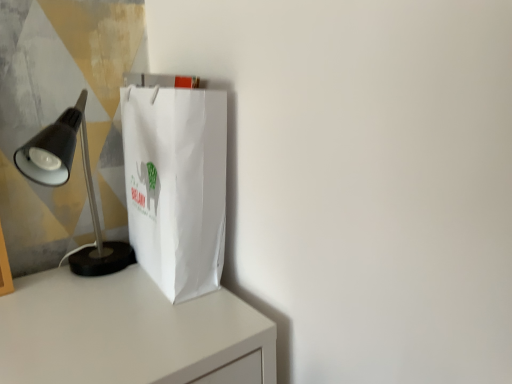
Question: From the image's perspective, is matte black lamp at left located above or below white paper bag at center?

Choices:
 (A) below
 (B) above

Answer: (A)

Question: From a real-world perspective, relative to white paper bag at center, is matte black lamp at left vertically above or below?

Choices:
 (A) below
 (B) above

Answer: (A)

Question: Considering the positions of matte black lamp at left and white paper bag at center in the image, is matte black lamp at left taller or shorter than white paper bag at center?

Choices:
 (A) tall
 (B) short

Answer: (B)

Question: Is white paper bag at center taller or shorter than matte black lamp at left?

Choices:
 (A) tall
 (B) short

Answer: (A)

Question: Relative to matte black lamp at left, is white paper bag at center in front or behind?

Choices:
 (A) behind
 (B) front

Answer: (A)

Question: Looking at their shapes, would you say white paper bag at center is wider or thinner than matte black lamp at left?

Choices:
 (A) thin
 (B) wide

Answer: (A)

Question: From a real-world perspective, relative to matte black lamp at left, is white paper bag at center vertically above or below?

Choices:
 (A) below
 (B) above

Answer: (B)